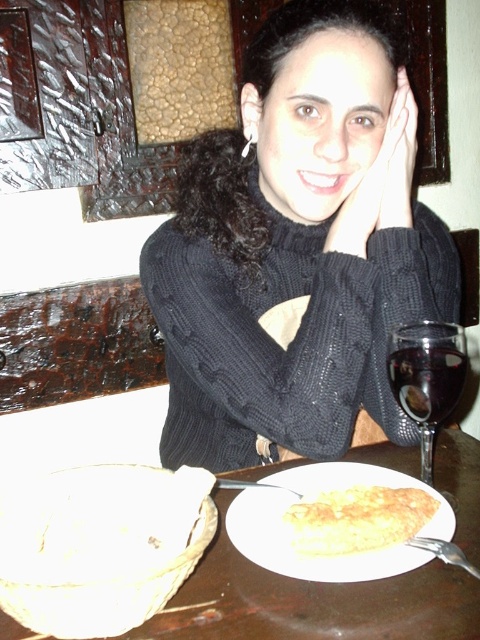
You are a fashion designer observing the scene. You need to determine if the black knitted sweater at center can be placed on the wooden table at center without hanging off the edges. Can you confirm this?

The black knitted sweater at center has a larger size compared to wooden table at center, so it would hang off the edges if placed on the wooden table at center.

You are a photographer setting up a shot of the scene described. You want to place a small prop to the right of the black knitted sweater at center but still on the wooden table at center. Is there enough space between them for the prop?

The black knitted sweater at center is positioned on the left side of wooden table at center, so placing a prop to the right of the black knitted sweater at center would be possible as long as there is space remaining on the wooden table at center. However, without specific measurements, it is uncertain if the space is sufficient.

You are standing behind the person at the wooden table. You want to place a small gift on the table such that it is closer to you than to the person. Which of the two points, point (x=297, y=577) or point (x=435, y=504), should you choose?

You should choose point (x=435, y=504) because it is farther from the person and closer to you compared to point (x=297, y=577).